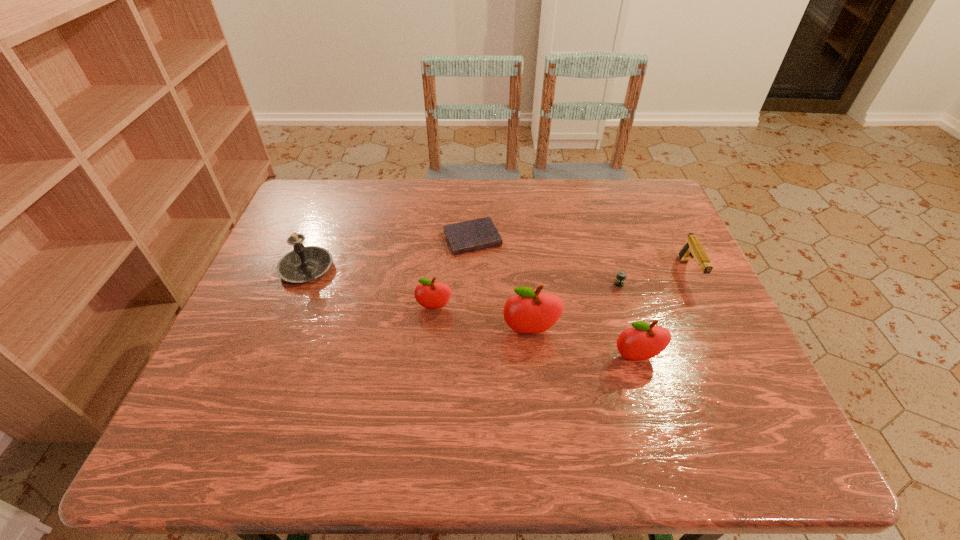
This screenshot has width=960, height=540. Identify the location of vacant space located 0.380m on the left of the farthest apple. (258, 307).

Identify the location of vacant space situated 0.200m on the left of the second nearest object. (415, 331).

The height and width of the screenshot is (540, 960). I want to click on vacant space located on the left of the nearest apple, so click(x=506, y=357).

Find the location of a particular element. vacant region located on the left of the shortest object is located at coordinates (303, 239).

This screenshot has width=960, height=540. In order to click on free spot located on the left of the beer can in this screenshot , I will do `click(531, 284)`.

Where is `vacant space located on the right of the candle`? This screenshot has width=960, height=540. vacant space located on the right of the candle is located at coordinates (444, 269).

Locate an element on the screen. vacant space located at the barrel of the pistol is located at coordinates (723, 345).

Identify the location of object located at the far edge. (477, 234).

The image size is (960, 540). I want to click on object that is positioned at the left edge, so click(305, 263).

This screenshot has width=960, height=540. I want to click on object situated at the right edge, so click(x=692, y=249).